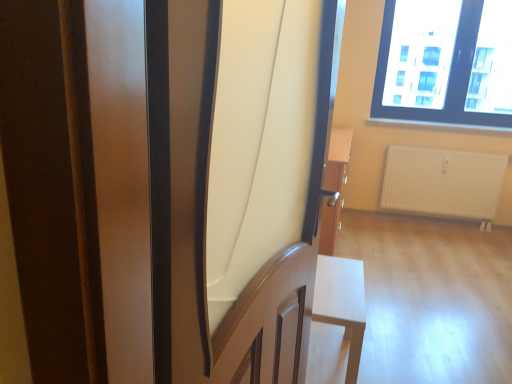
Locate an element on the screen. The width and height of the screenshot is (512, 384). free space in front of white matte radiator at lower right is located at coordinates (440, 244).